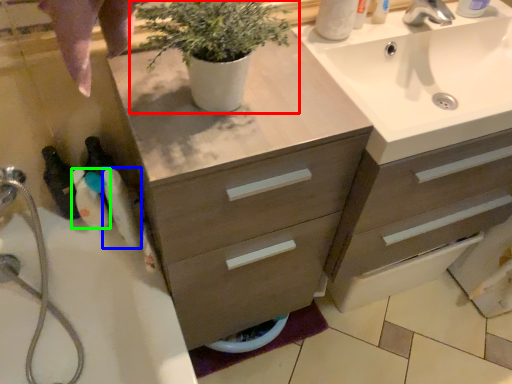
Question: Based on their relative distances, which object is farther from houseplant (highlighted by a red box)? Choose from toiletry (highlighted by a blue box) and toiletry (highlighted by a green box).

Choices:
 (A) toiletry
 (B) toiletry

Answer: (B)